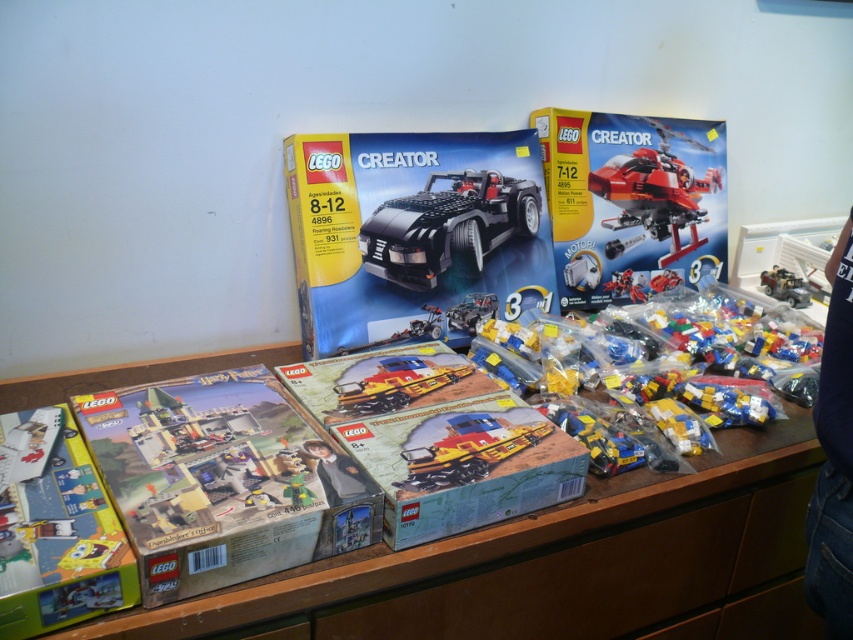
You are a photographer setting up a shot of the LEGO display. You want to focus on the point at the bottom right corner of the image. Which of the two points, point (614, 563) or point (772, 516), is closer to the camera and thus better for focusing to ensure clarity?

Point (614, 563) is closer to the camera than point (772, 516), so focusing on it will ensure better clarity.

You are organizing a child birthday party and need to set up a board game area. The wooden table at center is already occupied with LEGO sets. Can you place the cartoonish matte board game at lower left on the table without moving the LEGO sets?

The cartoonish matte board game at lower left is behind the wooden table at center, so it cannot be placed on the table without moving the LEGO sets because the board game is currently located behind the table.